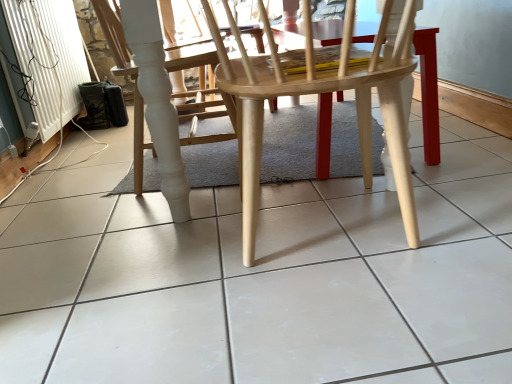
The image size is (512, 384). I want to click on vacant space in front of natural wood chair at center, the first chair viewed from the front, so click(356, 334).